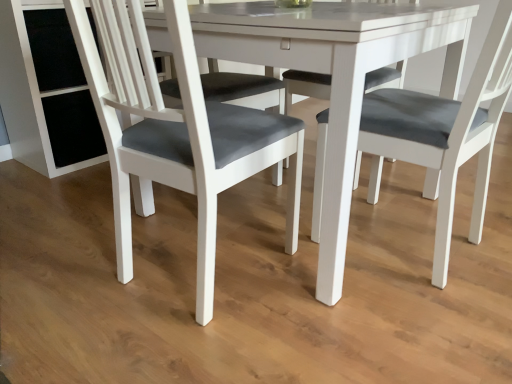
In order to face white glossy table at center, should I rotate leftwards or rightwards?

Turn right approximately 5.316 degrees to face it.

The height and width of the screenshot is (384, 512). Describe the element at coordinates (335, 76) in the screenshot. I see `white glossy table at center` at that location.

Identify the location of white glossy table at center. (335, 76).

At what (x,y) coordinates should I click in order to perform the action: click on matte gray fabric chair at left. Please return your answer as a coordinate pair (x, y). Looking at the image, I should click on (175, 132).

Image resolution: width=512 pixels, height=384 pixels. What do you see at coordinates (175, 132) in the screenshot? I see `matte gray fabric chair at left` at bounding box center [175, 132].

You are a GUI agent. You are given a task and a screenshot of the screen. Output one action in this format:
    pyautogui.click(x=<x>, y=<y>)
    Task: Click on the white glossy table at center
    Image resolution: width=512 pixels, height=384 pixels.
    Given the screenshot: What is the action you would take?
    pyautogui.click(x=335, y=76)

Which object is positioned more to the right, white glossy table at center or matte gray fabric chair at left?

From the viewer's perspective, white glossy table at center appears more on the right side.

Between white glossy table at center and matte gray fabric chair at left, which one is positioned in front?

matte gray fabric chair at left is in front.

Considering the positions of points (357, 84) and (214, 241), is point (357, 84) closer to camera compared to point (214, 241)?

Yes, point (357, 84) is in front of point (214, 241).

From the image's perspective, which one is positioned higher, white glossy table at center or matte gray fabric chair at left?

white glossy table at center.

From a real-world perspective, who is located lower, white glossy table at center or matte gray fabric chair at left?

white glossy table at center.

Considering the relative sizes of white glossy table at center and matte gray fabric chair at left in the image provided, is white glossy table at center wider than matte gray fabric chair at left?

Indeed, white glossy table at center has a greater width compared to matte gray fabric chair at left.

Considering the sizes of white glossy table at center and matte gray fabric chair at left in the image, is white glossy table at center taller or shorter than matte gray fabric chair at left?

white glossy table at center is shorter than matte gray fabric chair at left.

Between white glossy table at center and matte gray fabric chair at left, which one has larger size?

white glossy table at center.

Would you say white glossy table at center contains matte gray fabric chair at left?

Yes.

Is white glossy table at center next to matte gray fabric chair at left and touching it?

white glossy table at center and matte gray fabric chair at left are not in contact.

Is white glossy table at center positioned with its back to matte gray fabric chair at left?

No, white glossy table at center is not facing away from matte gray fabric chair at left.

Measure the distance between white glossy table at center and matte gray fabric chair at left.

A distance of 11.24 inches exists between white glossy table at center and matte gray fabric chair at left.

Identify the location of round table on the right of the matte gray fabric chair at left. This screenshot has height=384, width=512. (335, 76).

Considering the relative positions of matte gray fabric chair at left and white glossy table at center in the image provided, is matte gray fabric chair at left to the left of white glossy table at center from the viewer's perspective?

Correct, you'll find matte gray fabric chair at left to the left of white glossy table at center.

Which object is further away from the camera taking this photo, matte gray fabric chair at left or white glossy table at center?

white glossy table at center is further away from the camera.

Does point (114, 182) appear closer or farther from the camera than point (451, 77)?

Point (114, 182) appears to be closer to the viewer than point (451, 77).

From the image's perspective, relative to white glossy table at center, is matte gray fabric chair at left above or below?

Clearly, from the image's perspective, matte gray fabric chair at left is below white glossy table at center.

From the picture: From a real-world perspective, is matte gray fabric chair at left on top of white glossy table at center?

Yes.

In the scene shown: Between matte gray fabric chair at left and white glossy table at center, which one has larger width?

Wider between the two is white glossy table at center.

Between matte gray fabric chair at left and white glossy table at center, which one has more height?

With more height is matte gray fabric chair at left.

Considering the relative sizes of matte gray fabric chair at left and white glossy table at center in the image provided, is matte gray fabric chair at left smaller than white glossy table at center?

Indeed, matte gray fabric chair at left has a smaller size compared to white glossy table at center.

Is matte gray fabric chair at left inside or outside of white glossy table at center?

matte gray fabric chair at left is contained in white glossy table at center.

Is matte gray fabric chair at left beside white glossy table at center?

No, matte gray fabric chair at left is not with white glossy table at center.

Is matte gray fabric chair at left turned away from white glossy table at center?

matte gray fabric chair at left is not turned away from white glossy table at center.

Can you tell me how much matte gray fabric chair at left and white glossy table at center differ in facing direction?

93.8 degrees.

You are a GUI agent. You are given a task and a screenshot of the screen. Output one action in this format:
    pyautogui.click(x=<x>, y=<y>)
    Task: Click on the chair below the white glossy table at center (from the image's perspective)
    The height and width of the screenshot is (384, 512).
    Given the screenshot: What is the action you would take?
    pyautogui.click(x=175, y=132)

Locate an element on the screen. This screenshot has height=384, width=512. chair above the white glossy table at center (from a real-world perspective) is located at coordinates (175, 132).

This screenshot has width=512, height=384. I want to click on round table below the matte gray fabric chair at left (from a real-world perspective), so coord(335,76).